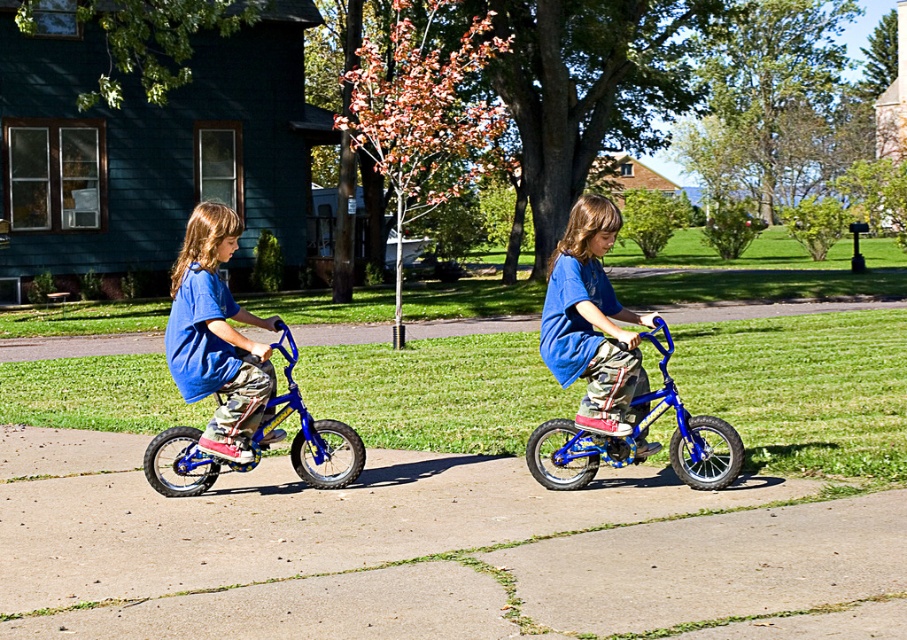
You are a photographer trying to capture a photo of the matte blue shirt at center and the blue metallic bicycle at center. If you want to ensure both are in focus, which object should you focus on first, the one closer to you or the one further away?

The matte blue shirt at center has a smaller size compared to blue metallic bicycle at center. Since smaller objects can sometimes be positioned closer or further away depending on their actual distance, but based on size alone, the smaller matte blue shirt at center is likely closer. To ensure both are in focus, you should focus on the object further away first, as depth of field extends behind the point of focus more effectively.

You are a photographer trying to capture the matte blue shirt at left in the image. Based on its coordinates, where should you focus your camera?

Result: The matte blue shirt at left is located at point [215,336], so you should focus your camera at those coordinates to capture it accurately.